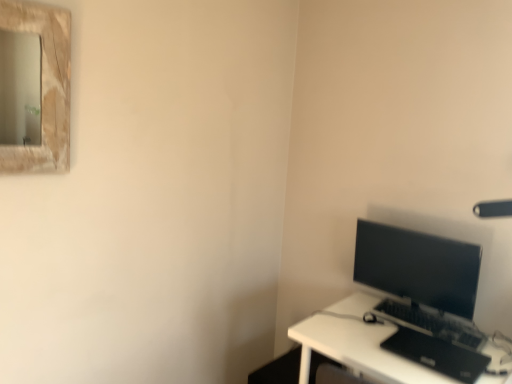
What are the coordinates of `vacant position to the left of matte black monitor at right` in the screenshot? It's located at (349, 320).